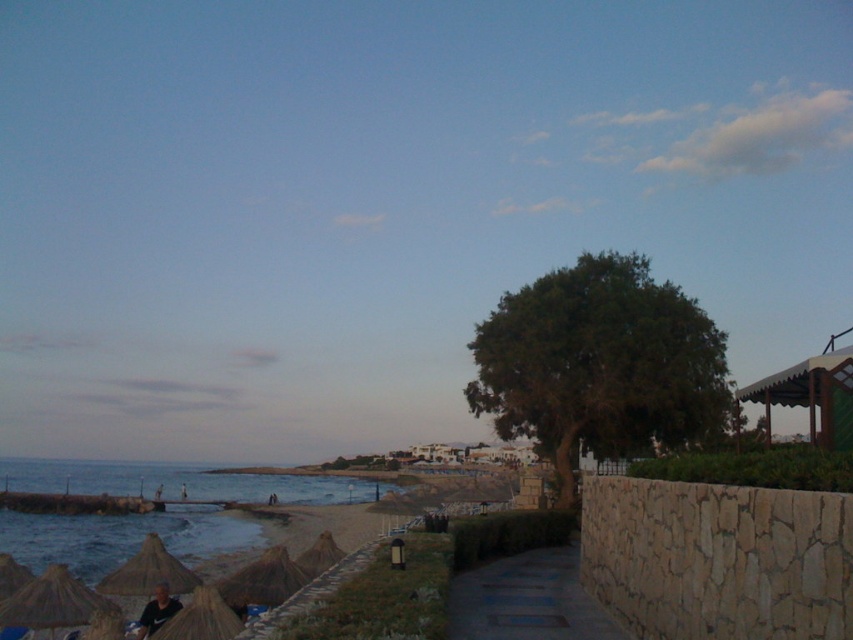
Question: Which object is positioned farthest from the blue stone path at center?

Choices:
 (A) brown wooden hut at right
 (B) green leafy tree at center-right

Answer: (B)

Question: Is blue stone path at center below brown wooden hut at right?

Choices:
 (A) no
 (B) yes

Answer: (A)

Question: Can you confirm if blue stone path at center is bigger than brown wooden hut at right?

Choices:
 (A) yes
 (B) no

Answer: (B)

Question: Is green leafy tree at center-right thinner than brown wooden hut at right?

Choices:
 (A) no
 (B) yes

Answer: (B)

Question: Which object is farther from the camera taking this photo?

Choices:
 (A) brown wooden hut at right
 (B) green leafy tree at center-right
 (C) blue stone path at center

Answer: (B)

Question: Estimate the real-world distances between objects in this image. Which object is farther from the brown wooden hut at right?

Choices:
 (A) blue stone path at center
 (B) green leafy tree at center-right

Answer: (A)